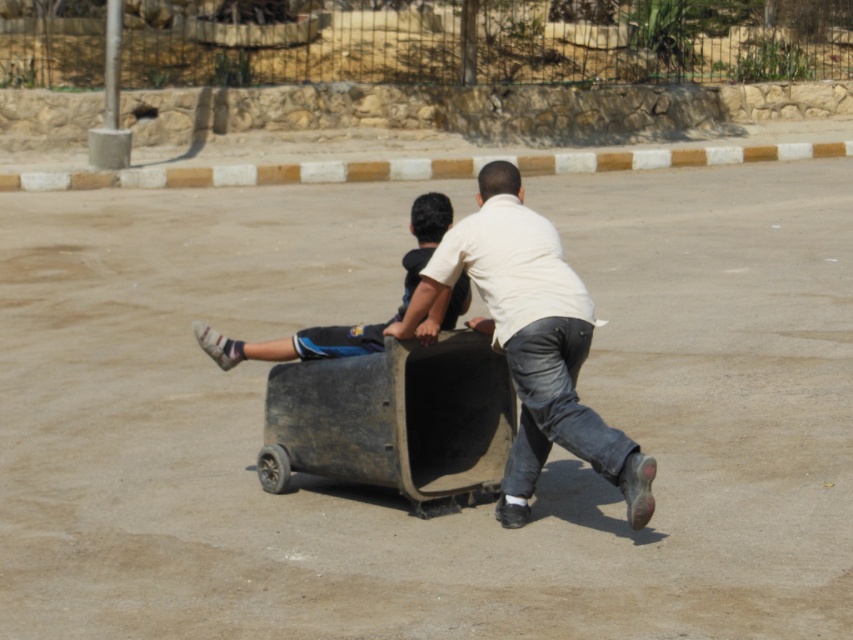
Who is more forward, (556, 237) or (393, 316)?

Point (556, 237) is in front.

Who is positioned more to the left, white matte shirt at center or dark blue fabric pants at center?

From the viewer's perspective, dark blue fabric pants at center appears more on the left side.

Who is more distant from viewer, (525, 321) or (432, 209)?

The point (432, 209) is more distant.

Find the location of `white matte shirt at center`. white matte shirt at center is located at coordinates (532, 340).

Does rusty metal wagon at center come in front of dark blue fabric pants at center?

No, rusty metal wagon at center is behind dark blue fabric pants at center.

Is point (412, 374) positioned in front of point (404, 310)?

No, (412, 374) is further to viewer.

Describe the element at coordinates (395, 420) in the screenshot. I see `rusty metal wagon at center` at that location.

Image resolution: width=853 pixels, height=640 pixels. What are the coordinates of `rusty metal wagon at center` in the screenshot? It's located at (395, 420).

Is rusty metal wagon at center wider than white matte shirt at center?

Yes, rusty metal wagon at center is wider than white matte shirt at center.

Can you confirm if rusty metal wagon at center is smaller than white matte shirt at center?

Correct, rusty metal wagon at center occupies less space than white matte shirt at center.

Who is more distant from viewer, (497, 416) or (518, 323)?

Point (497, 416)

I want to click on rusty metal wagon at center, so click(395, 420).